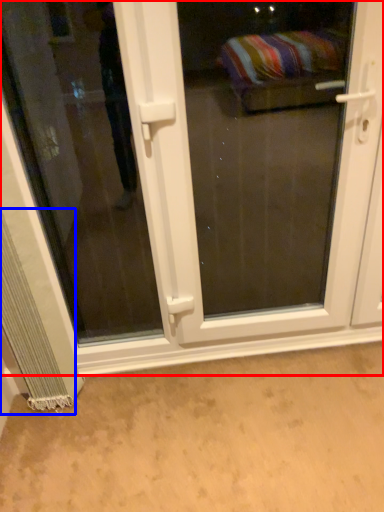
Question: Which of the following is the farthest to the observer, door (highlighted by a red box) or curtain (highlighted by a blue box)?

Choices:
 (A) door
 (B) curtain

Answer: (B)